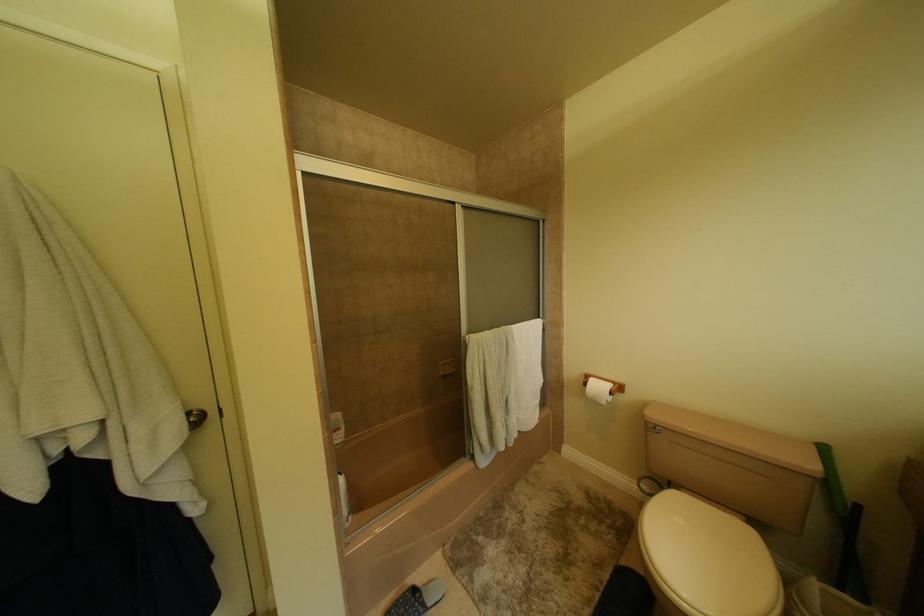
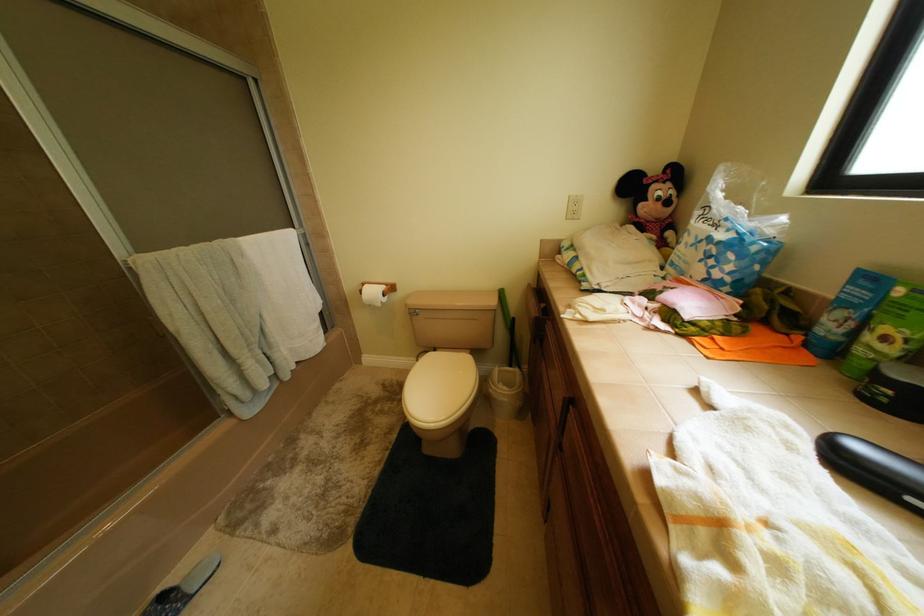
How did the camera likely rotate?

The camera rotated toward right-down.